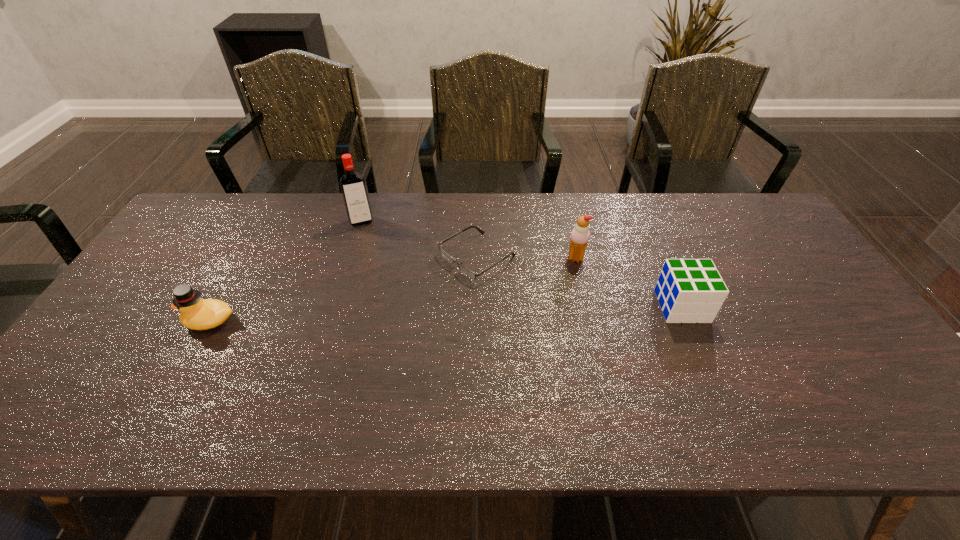
This screenshot has height=540, width=960. Find the location of `spectacles positioned at the far edge`. spectacles positioned at the far edge is located at coordinates (467, 272).

The width and height of the screenshot is (960, 540). Identify the location of vodka located at the far edge. (352, 184).

Find the location of `vacant region at the far edge of the desktop`. vacant region at the far edge of the desktop is located at coordinates (438, 237).

Where is `free space at the near edge`? The image size is (960, 540). free space at the near edge is located at coordinates (707, 387).

Find the location of a particular element. Image resolution: width=960 pixels, height=540 pixels. free spot at the left edge of the desktop is located at coordinates (201, 266).

Locate an element on the screen. vacant space at the right edge is located at coordinates (822, 327).

Where is `vacant point at the far left corner`? The height and width of the screenshot is (540, 960). vacant point at the far left corner is located at coordinates (220, 201).

Locate an element on the screen. vacant space at the far right corner of the desktop is located at coordinates (733, 203).

Locate an element on the screen. free space at the near right corner is located at coordinates point(892,380).

This screenshot has height=540, width=960. Identify the location of unoccupied area between the leftmost object and the farthest object. (286, 271).